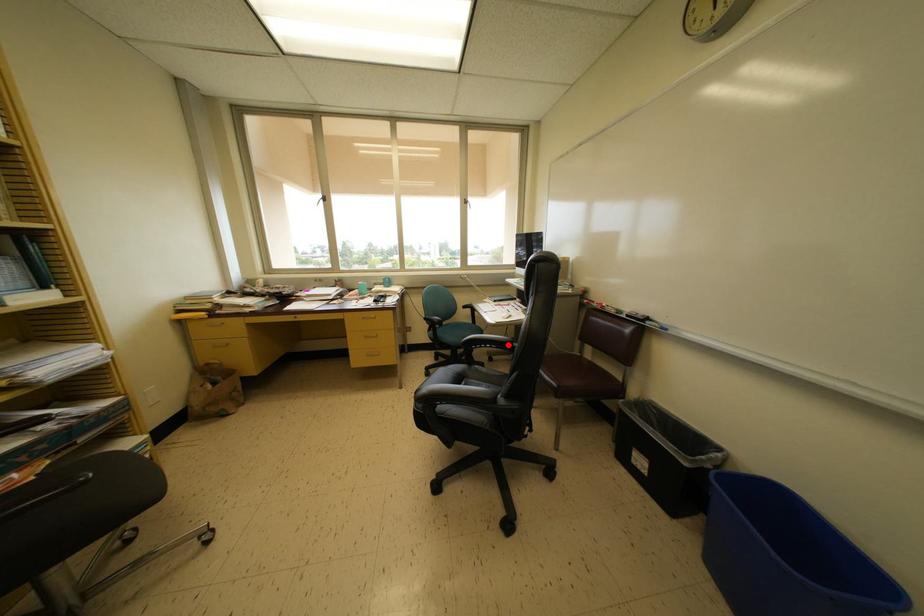
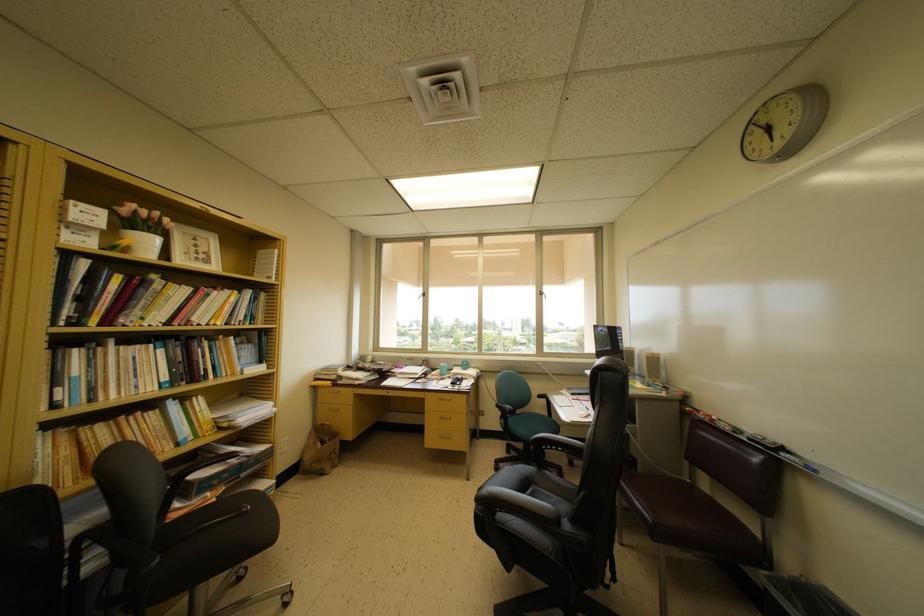
Question: I am providing you with two images of the same scene from different viewpoints. A red point is shown in image1. For the corresponding object point in image2, is it positioned nearer or farther from the camera?

Choices:
 (A) Nearer
 (B) Farther

Answer: (A)